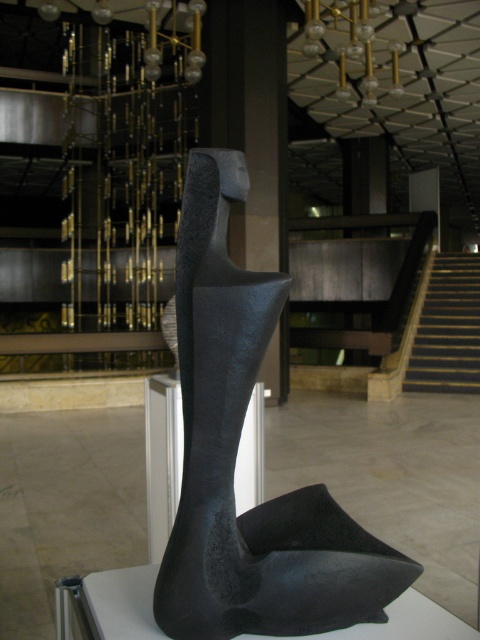
Question: Is matte black sculpture at center above dark brown wooden stairs at right?

Choices:
 (A) yes
 (B) no

Answer: (B)

Question: Which of the following is the closest to the observer?

Choices:
 (A) matte black sculpture at center
 (B) dark brown wooden stairs at right

Answer: (A)

Question: Does matte black sculpture at center appear on the left side of dark brown wooden stairs at right?

Choices:
 (A) yes
 (B) no

Answer: (A)

Question: Among these points, which one is farthest from the camera?

Choices:
 (A) (463, 268)
 (B) (240, 419)

Answer: (A)

Question: Where is matte black sculpture at center located in relation to dark brown wooden stairs at right in the image?

Choices:
 (A) right
 (B) left

Answer: (B)